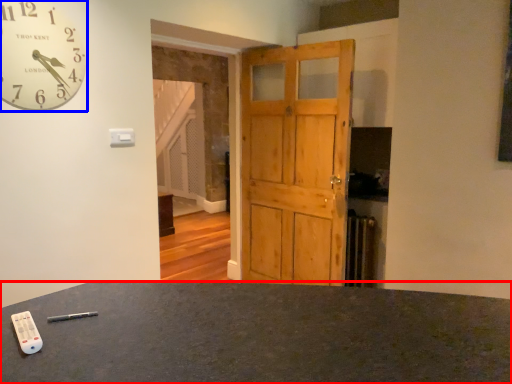
Question: Among these objects, which one is nearest to the camera, desk (highlighted by a red box) or wall clock (highlighted by a blue box)?

Choices:
 (A) desk
 (B) wall clock

Answer: (A)